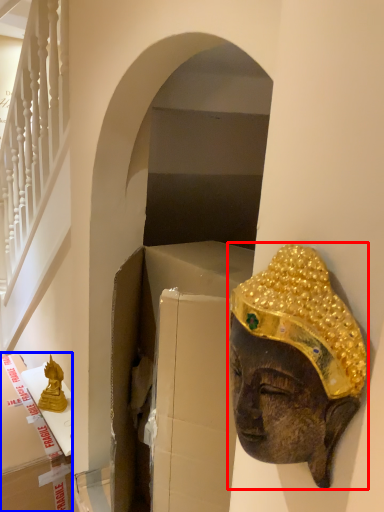
Question: Which of the following is the closest to the observer, person (highlighted by a red box) or cardboard box (highlighted by a blue box)?

Choices:
 (A) person
 (B) cardboard box

Answer: (A)